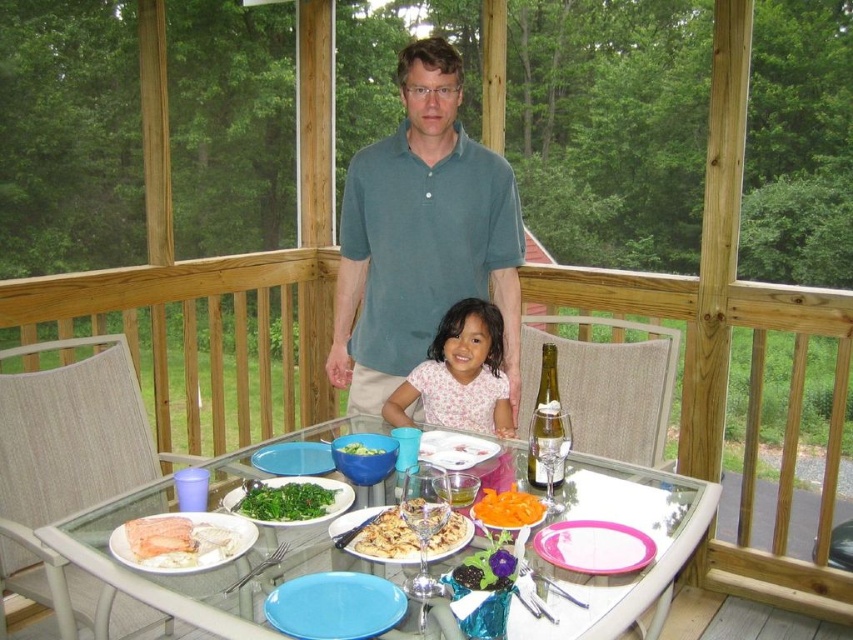
Does golden brown bread at center have a larger size compared to clear glass bottle at table center?

No, golden brown bread at center is not bigger than clear glass bottle at table center.

Which is below, golden brown bread at center or clear glass bottle at table center?

Positioned lower is golden brown bread at center.

In order to click on golden brown bread at center in this screenshot , I will do `click(386, 538)`.

In order to click on golden brown bread at center in this screenshot , I will do `click(386, 538)`.

Based on the photo, which of these two, transparent glass table at center or teal cotton polo shirt at center, stands shorter?

With less height is transparent glass table at center.

At what (x,y) coordinates should I click in order to perform the action: click on transparent glass table at center. Please return your answer as a coordinate pair (x, y). Looking at the image, I should click on (724, 400).

Who is more distant from viewer, (183, 292) or (440, 156)?

The point (183, 292) is more distant.

I want to click on transparent glass table at center, so click(724, 400).

Can you confirm if transparent glass table at center is wider than blue plastic plate at center?

Correct, the width of transparent glass table at center exceeds that of blue plastic plate at center.

In the scene shown: Who is more forward, (242, 298) or (286, 451)?

Point (286, 451)

Where is `transparent glass table at center`? This screenshot has height=640, width=853. transparent glass table at center is located at coordinates (724, 400).